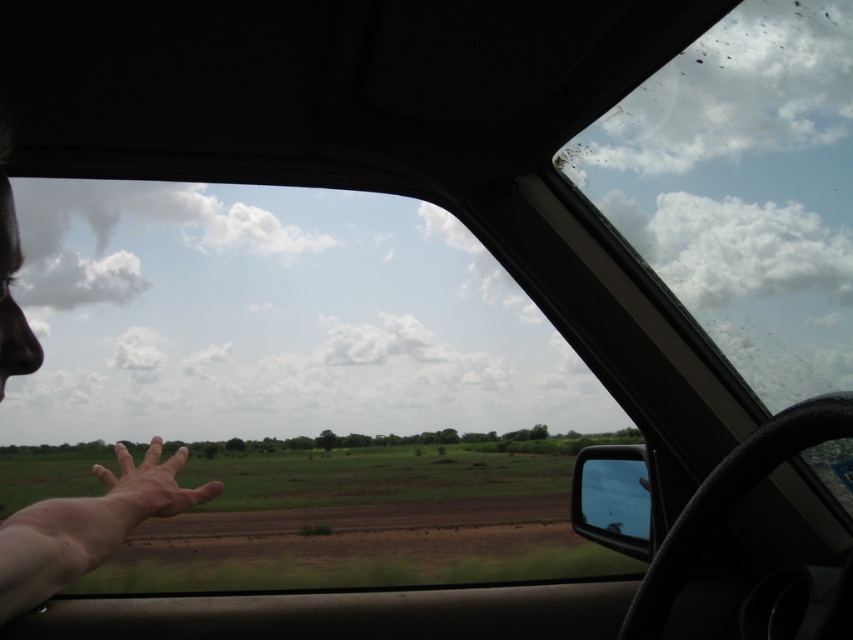
You are driving a car and want to check the weather outside. Which object would block your view of the sky more, the transparent glass windshield at upper right or the skinny flesh hand at lower left?

The transparent glass windshield at upper right is bigger than the skinny flesh hand at lower left, so it would block your view of the sky more.

In the scene shown: You are a passenger in the car and want to look out through the transparent glass windshield at upper right while keeping your hand on the skinny flesh hand at lower left. Can you do both at the same time?

The transparent glass windshield at upper right is taller than the skinny flesh hand at lower left, so yes, you can look out through the transparent glass windshield at upper right while keeping your hand on the skinny flesh hand at lower left because the windshield extends higher up, allowing both actions to be performed simultaneously.

You are driving and need to check both the transparent glass windshield at upper right and the skinny flesh hand at lower left in your car. Which object is wider?

The transparent glass windshield at upper right is wider than the skinny flesh hand at lower left.